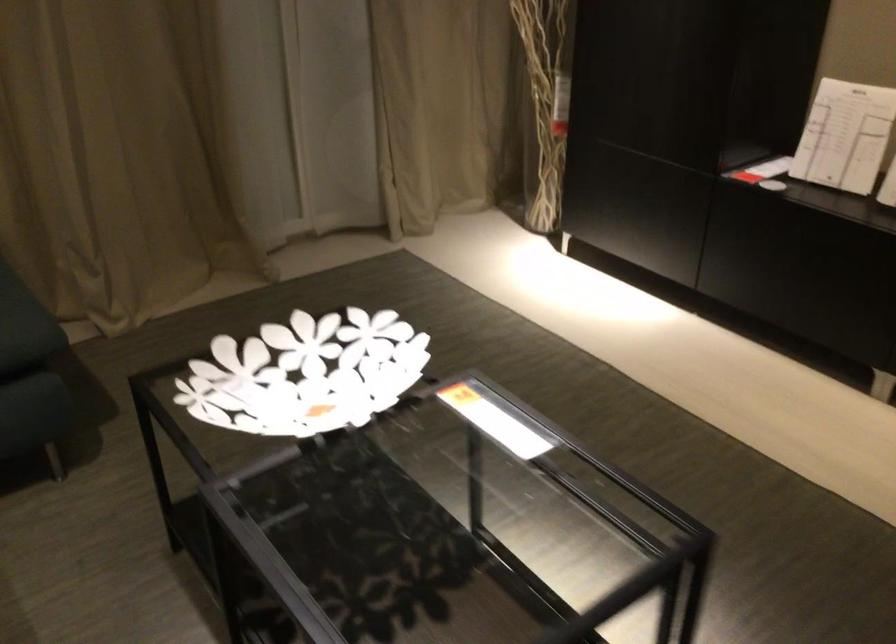
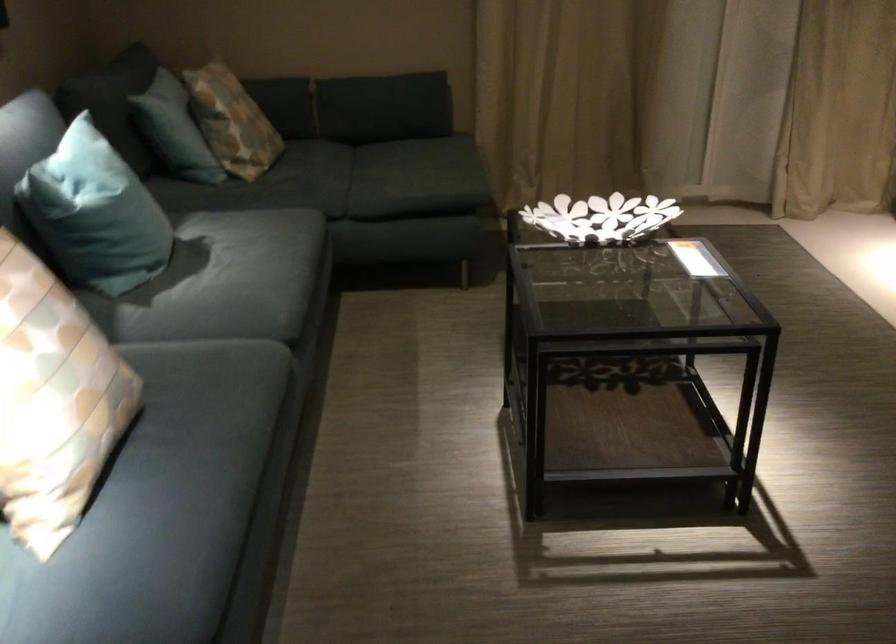
In the second image, find the point that corresponds to [280,359] in the first image.

(600, 218)